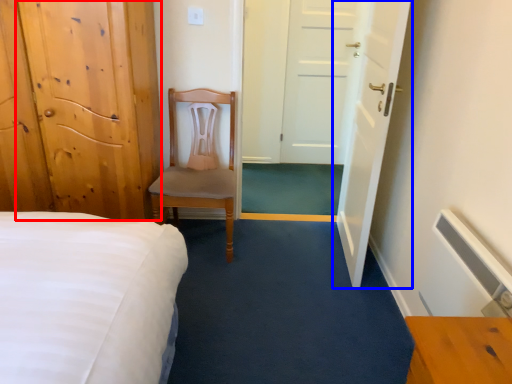
Question: Which of the following is the closest to the observer, door (highlighted by a red box) or door (highlighted by a blue box)?

Choices:
 (A) door
 (B) door

Answer: (A)